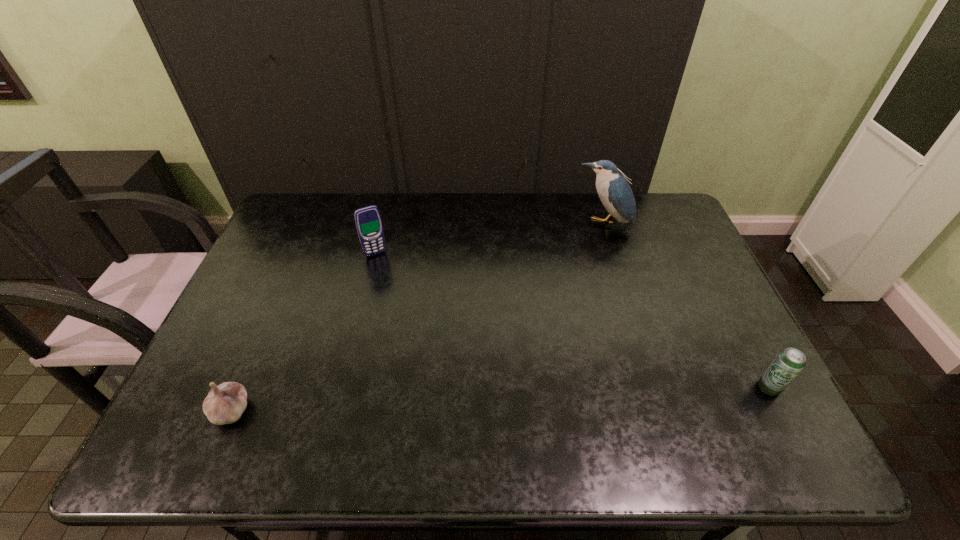
At what (x,y) coordinates should I click in order to perform the action: click on free location that satisfies the following two spatial constraints: 1. on the back side of the second tallest object; 2. on the left side of the bird. Please return your answer as a coordinate pair (x, y). The height and width of the screenshot is (540, 960). Looking at the image, I should click on (383, 225).